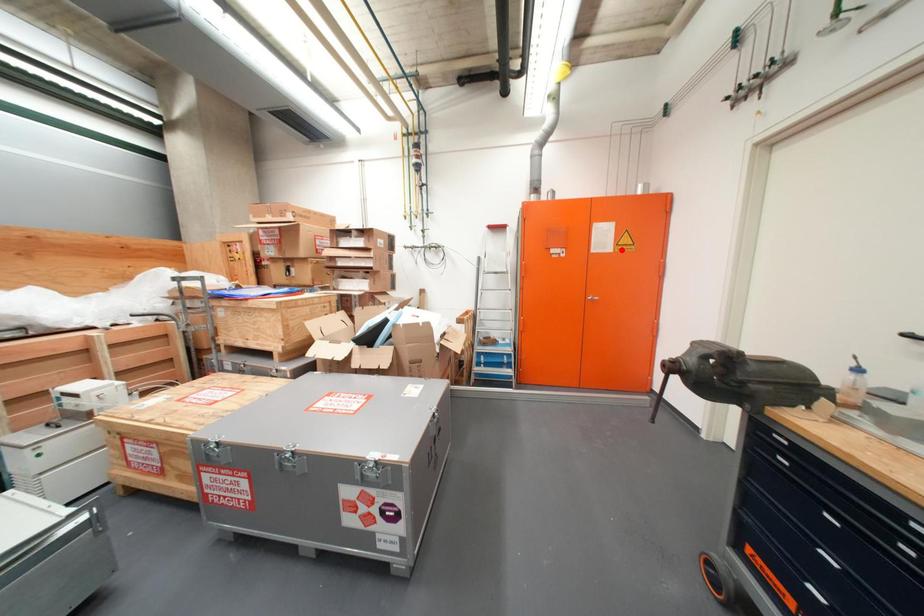
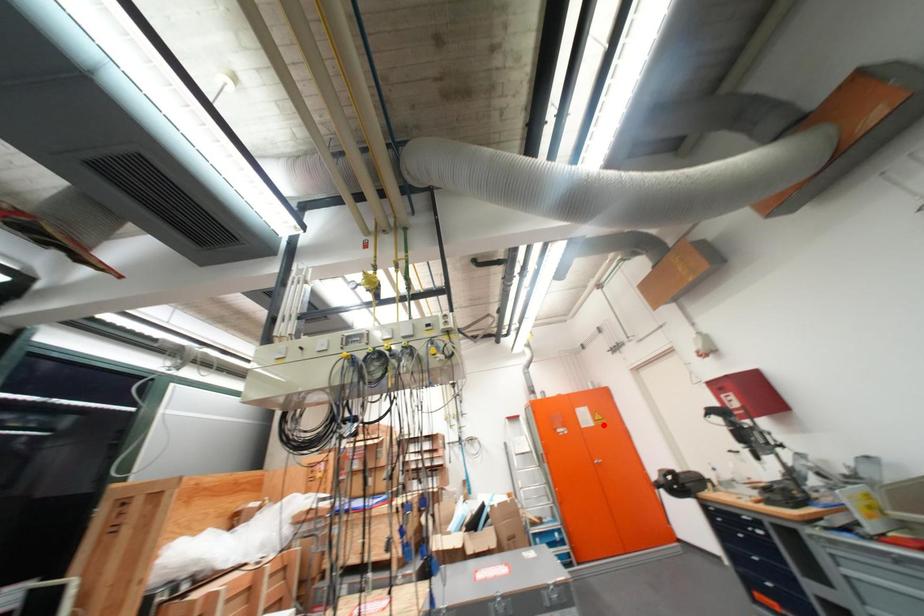
I am providing you with two images of the same scene from different viewpoints. A red point is marked on the first image and another point is marked on the second image. Are the points marked in image1 and image2 representing the same 3D position?

Yes